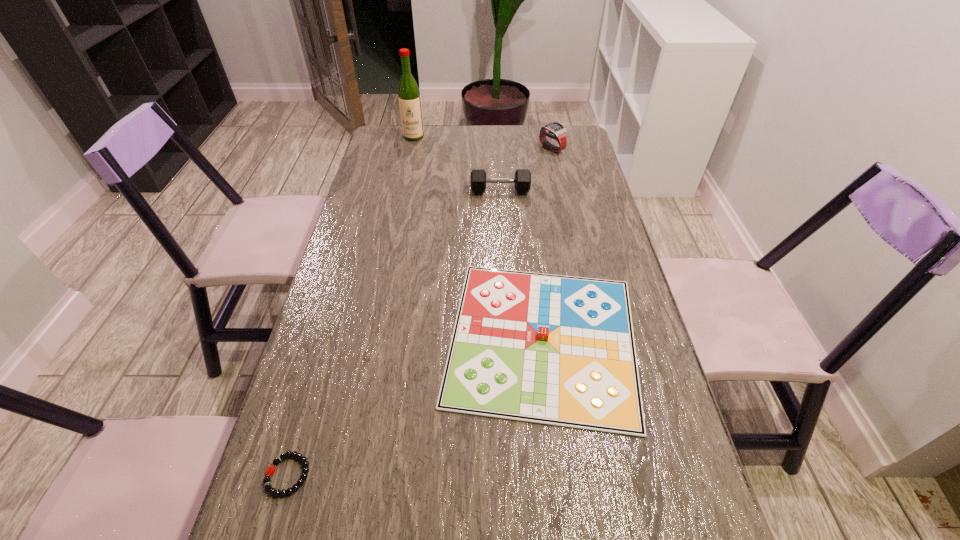
I want to click on object present at the far right corner, so click(x=556, y=130).

Where is `vacant space at the far edge`? vacant space at the far edge is located at coordinates (505, 146).

Locate an element on the screen. Image resolution: width=960 pixels, height=540 pixels. vacant area at the left edge is located at coordinates (316, 424).

Where is `free location at the right edge`? The height and width of the screenshot is (540, 960). free location at the right edge is located at coordinates (606, 233).

Locate an element on the screen. This screenshot has width=960, height=540. vacant space at the far left corner is located at coordinates click(412, 148).

Find the location of a particular element. The height and width of the screenshot is (540, 960). empty location between the tallest object and the dumbbell is located at coordinates (457, 164).

Locate an element on the screen. free space between the tallest object and the shortest object is located at coordinates (351, 306).

Identify the location of free space between the watch and the tallest object. The image size is (960, 540). (483, 143).

This screenshot has width=960, height=540. In order to click on free spot between the watch and the fourth object from right to left in this screenshot , I will do `click(483, 143)`.

Locate an element on the screen. The image size is (960, 540). unoccupied area between the bracelet and the watch is located at coordinates (420, 312).